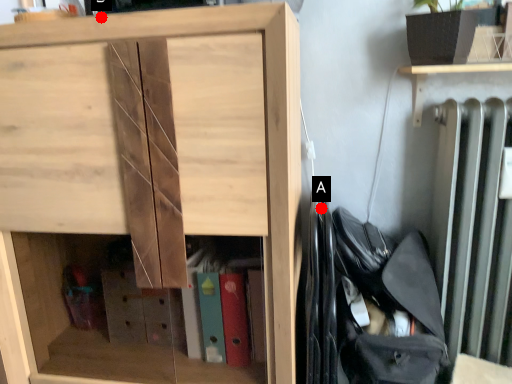
Question: Two points are circled on the image, labeled by A and B beside each circle. Which point appears farthest from the camera in this image?

Choices:
 (A) A is further
 (B) B is further

Answer: (A)